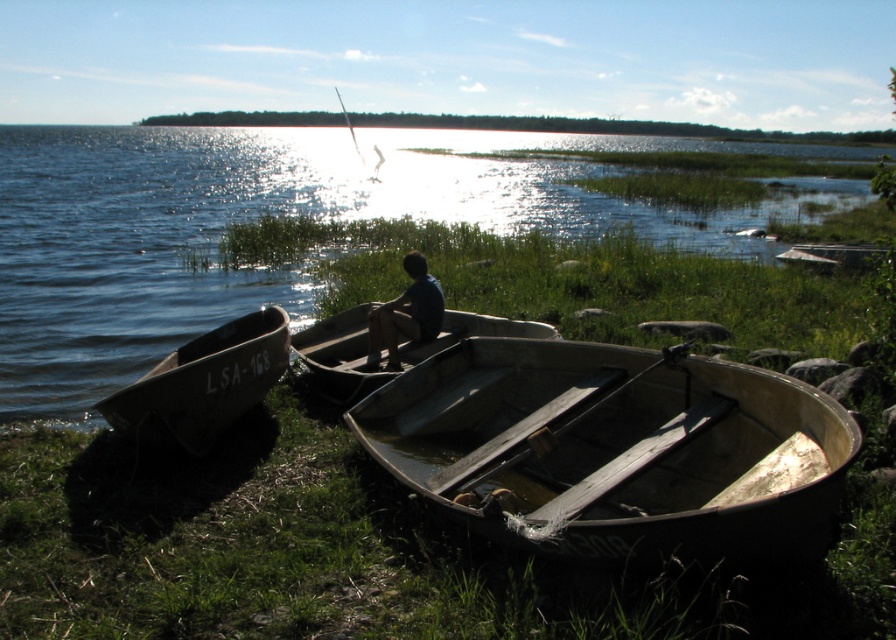
Question: Considering the real-world distances, which object is farthest from the rusty metal boat at lower right?

Choices:
 (A) glistening water at boat right
 (B) greenish metallic boat at lower left
 (C) blue matte shirt at center
 (D) matte gray canoe at center

Answer: (A)

Question: Among these objects, which one is farthest from the camera?

Choices:
 (A) blue matte shirt at center
 (B) glistening water at boat right

Answer: (B)

Question: Observing the image, what is the correct spatial positioning of matte gray canoe at center in reference to blue matte shirt at center?

Choices:
 (A) above
 (B) below

Answer: (B)

Question: Does rusty metal boat at lower right appear on the left side of matte gray canoe at center?

Choices:
 (A) yes
 (B) no

Answer: (B)

Question: In this image, where is greenish metallic boat at lower left located relative to matte gray canoe at center?

Choices:
 (A) above
 (B) below

Answer: (B)

Question: Which object is positioned farthest from the blue matte shirt at center?

Choices:
 (A) greenish metallic boat at lower left
 (B) rusty metal boat at lower right

Answer: (B)